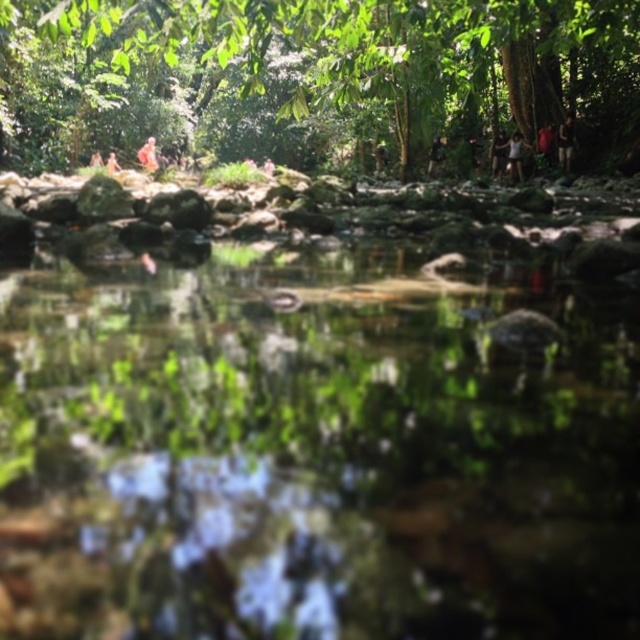
Is white cotton shirt at upper right to the right of light brown wooden stick at upper right from the viewer's perspective?

Incorrect, white cotton shirt at upper right is not on the right side of light brown wooden stick at upper right.

Between white cotton shirt at upper right and light brown wooden stick at upper right, which one has more height?

Standing taller between the two is white cotton shirt at upper right.

Locate an element on the screen. The height and width of the screenshot is (640, 640). white cotton shirt at upper right is located at coordinates (513, 154).

Between point (516, 147) and point (564, 170), which one is positioned in front?

Point (564, 170)

Is white cotton shirt at upper right taller than dark brown leather jacket at upper right?

No.

The height and width of the screenshot is (640, 640). Identify the location of white cotton shirt at upper right. (513, 154).

Who is positioned more to the right, dark brown leather jacket at upper right or dark brown leather jacket at upper center?

dark brown leather jacket at upper right

What do you see at coordinates (564, 141) in the screenshot?
I see `dark brown leather jacket at upper right` at bounding box center [564, 141].

The height and width of the screenshot is (640, 640). Describe the element at coordinates (564, 141) in the screenshot. I see `dark brown leather jacket at upper right` at that location.

This screenshot has height=640, width=640. Identify the location of dark brown leather jacket at upper right. (564, 141).